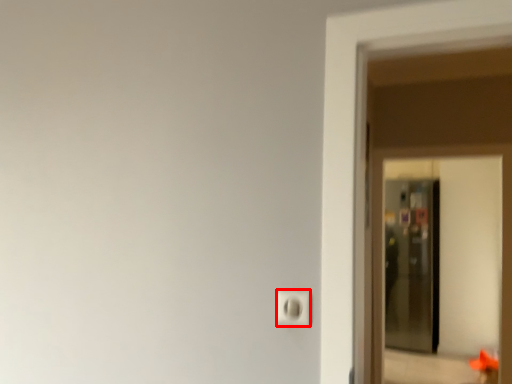
Question: From the image's perspective, what is the correct spatial relationship of light switch (annotated by the red box) in relation to screen door?

Choices:
 (A) above
 (B) below

Answer: (A)